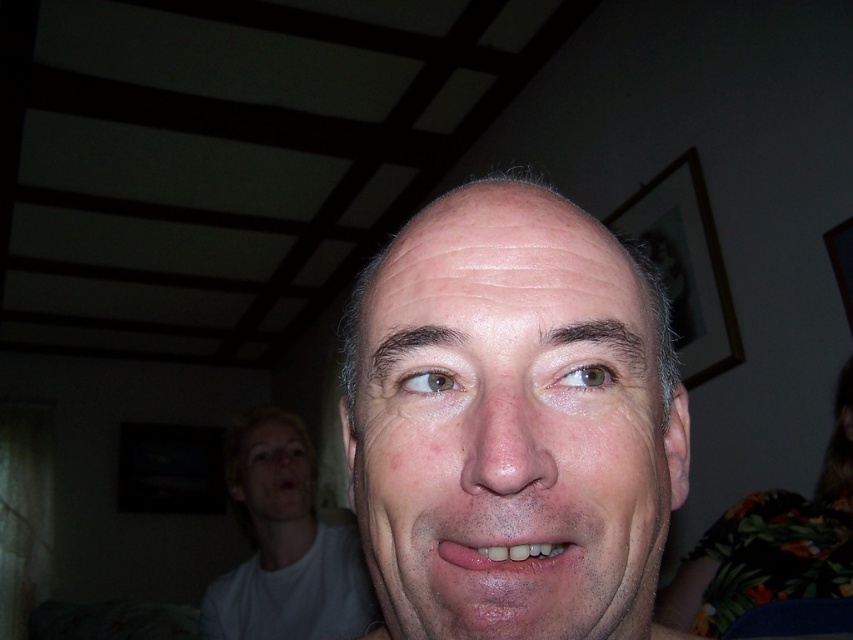
Question: Which object is positioned farthest from the white matte face at center?

Choices:
 (A) pink matte lips at center
 (B) smooth skin face at lower left

Answer: (A)

Question: Among these points, which one is nearest to the camera?

Choices:
 (A) (292, 460)
 (B) (527, 545)
 (C) (297, 502)
 (D) (604, 442)

Answer: (B)

Question: Where is smooth skin face at center located in relation to white matte face at center in the image?

Choices:
 (A) above
 (B) below

Answer: (A)

Question: Can you confirm if white matte face at center is positioned to the left of pink matte lips at center?

Choices:
 (A) yes
 (B) no

Answer: (A)

Question: Is smooth skin face at center positioned behind white matte face at center?

Choices:
 (A) no
 (B) yes

Answer: (A)

Question: Estimate the real-world distances between objects in this image. Which object is closer to the smooth skin face at center?

Choices:
 (A) pink matte lips at center
 (B) white matte face at center

Answer: (A)